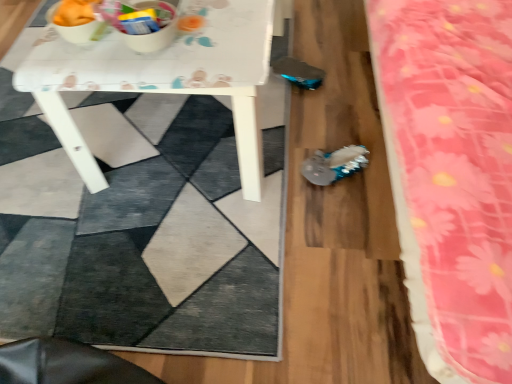
Question: Is the surface of pink floral fabric at right in direct contact with shiny metallic shoe at center?

Choices:
 (A) no
 (B) yes

Answer: (A)

Question: Would you say pink floral fabric at right is a long distance from shiny metallic shoe at center?

Choices:
 (A) no
 (B) yes

Answer: (A)

Question: Can you confirm if pink floral fabric at right is positioned to the right of shiny metallic shoe at center?

Choices:
 (A) no
 (B) yes

Answer: (B)

Question: Does pink floral fabric at right contain shiny metallic shoe at center?

Choices:
 (A) yes
 (B) no

Answer: (B)

Question: From the image's perspective, is pink floral fabric at right located above shiny metallic shoe at center?

Choices:
 (A) no
 (B) yes

Answer: (B)

Question: Can you confirm if pink floral fabric at right is shorter than shiny metallic shoe at center?

Choices:
 (A) no
 (B) yes

Answer: (A)

Question: From a real-world perspective, is shiny metallic shoe at center on top of pink floral fabric at right?

Choices:
 (A) no
 (B) yes

Answer: (A)

Question: Does shiny metallic shoe at center contain pink floral fabric at right?

Choices:
 (A) no
 (B) yes

Answer: (A)

Question: Is shiny metallic shoe at center positioned with its back to pink floral fabric at right?

Choices:
 (A) no
 (B) yes

Answer: (B)

Question: Considering the relative sizes of shiny metallic shoe at center and pink floral fabric at right in the image provided, is shiny metallic shoe at center taller than pink floral fabric at right?

Choices:
 (A) yes
 (B) no

Answer: (B)

Question: Does shiny metallic shoe at center lie behind pink floral fabric at right?

Choices:
 (A) yes
 (B) no

Answer: (A)

Question: Is shiny metallic shoe at center at the right side of pink floral fabric at right?

Choices:
 (A) yes
 (B) no

Answer: (B)

Question: Is shiny metallic shoe at center behind white glossy table at center?

Choices:
 (A) no
 (B) yes

Answer: (B)